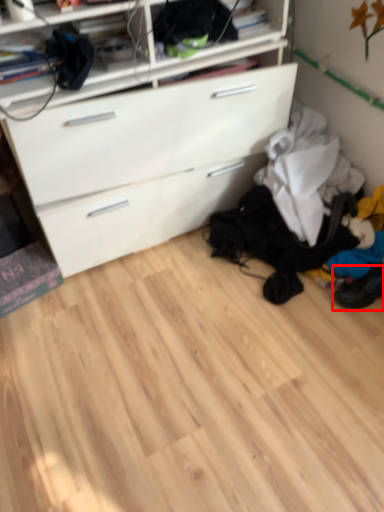
Question: From the image, what is the correct spatial relationship of footwear (annotated by the red box) in relation to shelf?

Choices:
 (A) right
 (B) left

Answer: (A)